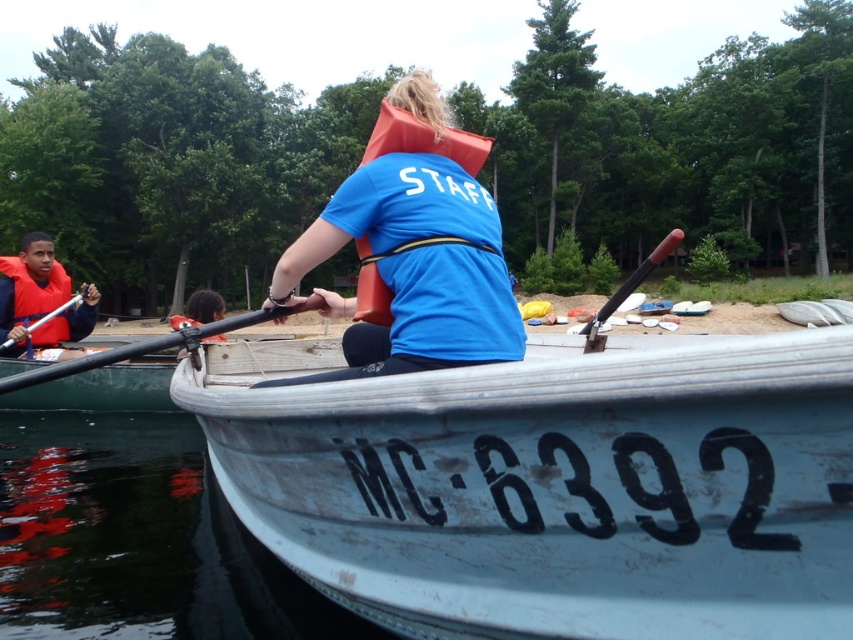
You are a safety inspector reviewing the scene. The orange foam life jacket at center is located at coordinates 0.219, 0.498. Is this position within the recommended safety zone for life jackets on a boat? Please explain your reasoning.

The orange foam life jacket at center is located at point [424,140]. According to standard safety guidelines, life jackets should be placed within easy reach of all passengers, typically near seating areas. Since the jacket is centrally positioned, it is likely within the recommended safety zone as it would be accessible to most passengers.

You are a safety inspector checking the equipment on the boat. You see the orange foam life jacket at center and the black rubber paddle at center. Which item is taller?

The orange foam life jacket at center is much taller than the black rubber paddle at center.

You are a safety inspector checking the equipment on the boat. You notice the orange foam life jacket at center and the black rubber paddle at center. Which item is thinner?

The orange foam life jacket at center is thinner than the black rubber paddle at center.